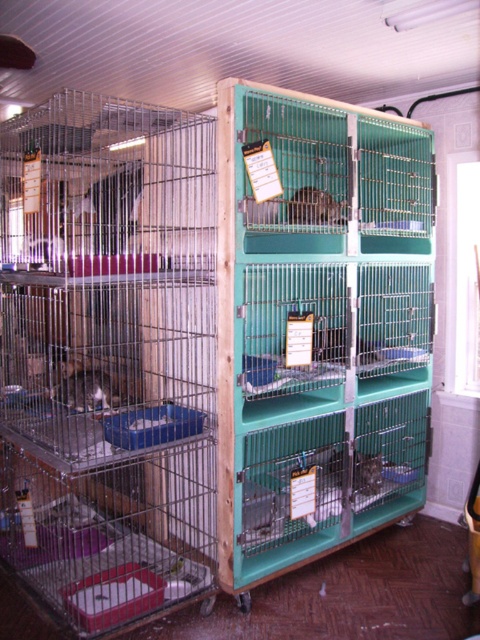
You are a customer in the pet store and want to see both the point at (290, 156) and the point at (84, 401). Which point do you need to look closer to the front of the cages to see?

You need to look closer to the front of the cages to see point (84, 401) because it is closer to the viewer than point (290, 156).

You are an animal caretaker in the pet store. You need to check the health of the white fur cat at left and the shiny metallic cage at center. Which animal is easier to observe from your current position?

The white fur cat at left is located above the shiny metallic cage at center, so it is easier to observe the white fur cat at left from your current position.

You are a customer at the pet store looking to adopt a pet. You see the teal plastic cage at center and the white fur cat at left. Which one is taller?

The teal plastic cage at center is taller than the white fur cat at left.